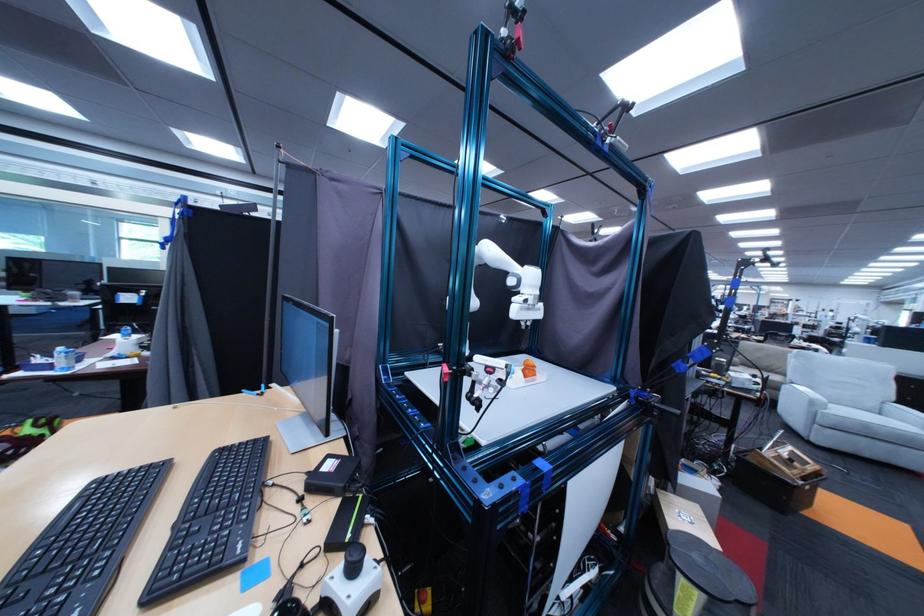
Find where to leaning on the sofa armrest. Please return your answer as a coordinate pair (x, y).

(854, 421)